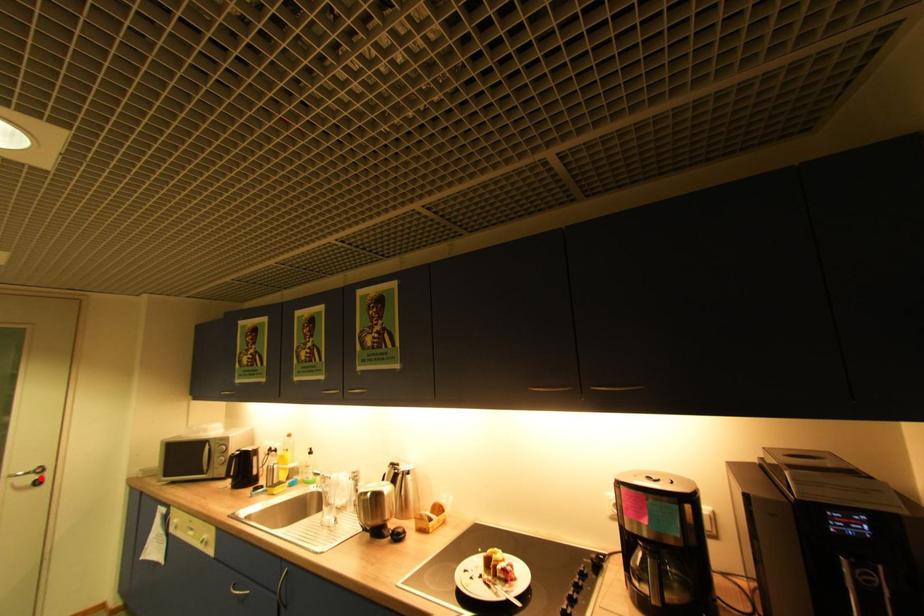
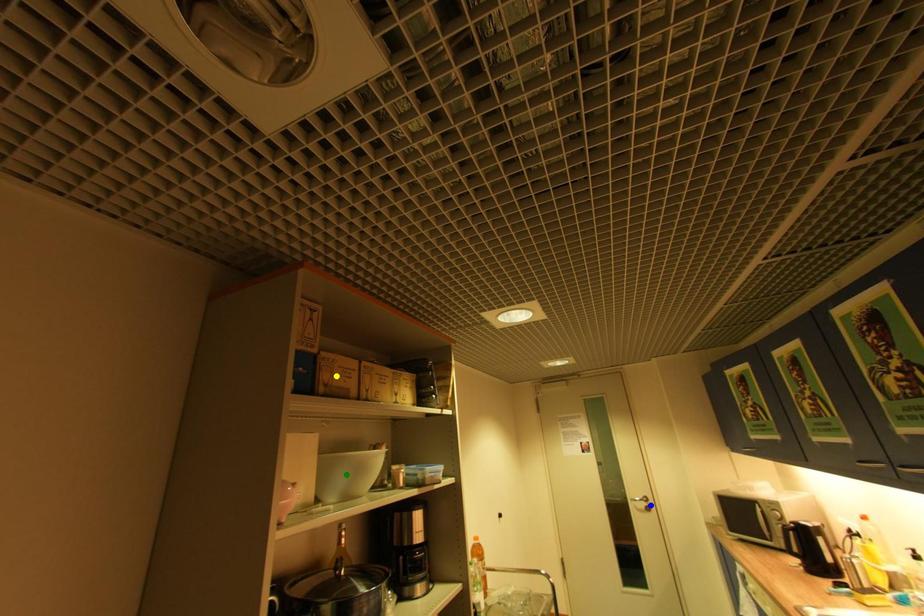
Question: I am providing you with two images of the same scene from different viewpoints. A red point is marked on the first image. You are given multiple points on the second image. In image 2, which mark is for the same physical point as the one in image 1?

Choices:
 (A) yellow point
 (B) blue point
 (C) green point

Answer: (B)